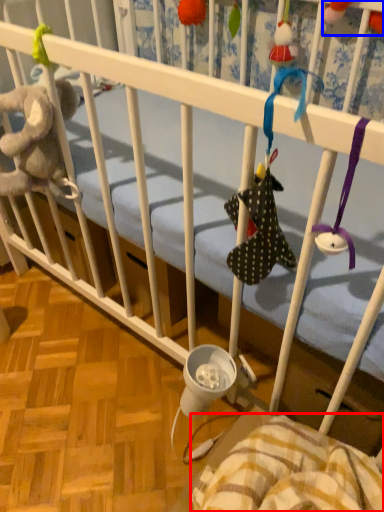
Question: Among these objects, which one is farthest to the camera, blanket (highlighted by a red box) or toy (highlighted by a blue box)?

Choices:
 (A) blanket
 (B) toy

Answer: (B)